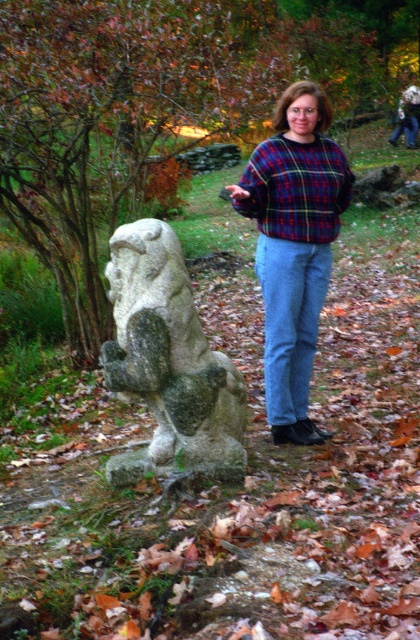
Describe the element at coordinates (168, 362) in the screenshot. The width and height of the screenshot is (420, 640). I see `gray stone statue at center` at that location.

Where is `gray stone statue at center`? The width and height of the screenshot is (420, 640). gray stone statue at center is located at coordinates (168, 362).

Identify the location of gray stone statue at center. This screenshot has height=640, width=420. (168, 362).

Who is higher up, plaid sweater at center or plaid fabric sweater at center?

plaid fabric sweater at center

From the picture: Between plaid sweater at center and plaid fabric sweater at center, which one appears on the right side from the viewer's perspective?

plaid fabric sweater at center

Where is `plaid sweater at center`? This screenshot has width=420, height=640. plaid sweater at center is located at coordinates (294, 246).

Does gray stone statue at center have a greater width compared to plaid fabric sweater at center?

Yes.

Between point (152, 404) and point (331, 141), which one is positioned in front?

Point (152, 404)

Image resolution: width=420 pixels, height=640 pixels. In order to click on gray stone statue at center in this screenshot , I will do `click(168, 362)`.